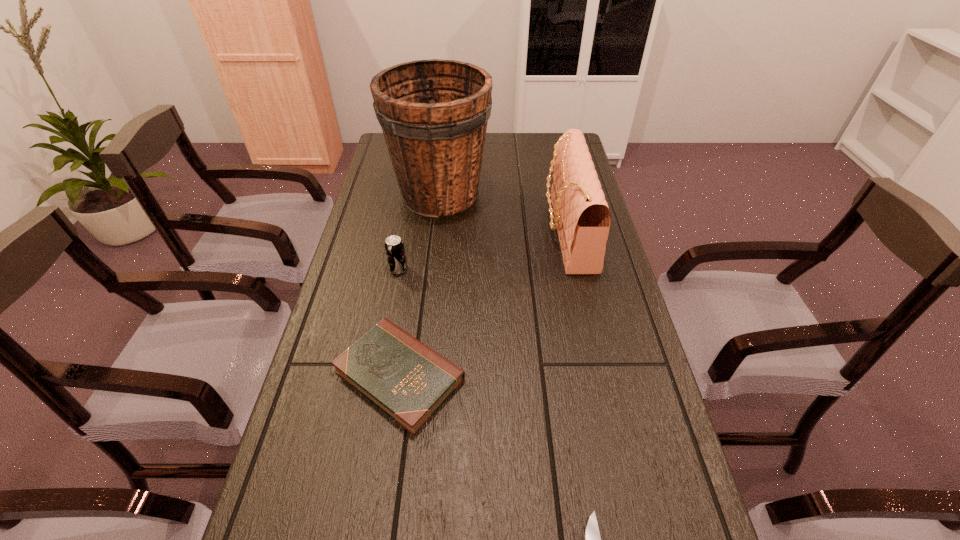
Identify the location of free space located 0.310m on the back of the second nearest object. coord(419,245).

Where is `bucket that is positioned at the left edge`? The width and height of the screenshot is (960, 540). bucket that is positioned at the left edge is located at coordinates (433, 113).

At what (x,y) coordinates should I click in order to perform the action: click on soda can located in the left edge section of the desktop. Please return your answer as a coordinate pair (x, y). Looking at the image, I should click on (394, 246).

Locate an element on the screen. The image size is (960, 540). Bible present at the left edge is located at coordinates (406, 379).

The height and width of the screenshot is (540, 960). I want to click on object situated at the right edge, so click(x=582, y=218).

You are a GUI agent. You are given a task and a screenshot of the screen. Output one action in this format:
    pyautogui.click(x=<x>, y=<y>)
    Task: Click on the vacant position at the far edge of the desktop
    The height and width of the screenshot is (540, 960).
    Given the screenshot: What is the action you would take?
    pyautogui.click(x=526, y=148)

In the image, there is a desktop. Identify the location of free region at the left edge. (332, 345).

This screenshot has height=540, width=960. In order to click on blank area at the right edge in this screenshot , I will do `click(668, 424)`.

Find the location of `free spot between the soda can and the second tallest object`. free spot between the soda can and the second tallest object is located at coordinates (483, 250).

Where is `unoccupied position between the fourth farthest object and the second tallest object`? The image size is (960, 540). unoccupied position between the fourth farthest object and the second tallest object is located at coordinates (484, 303).